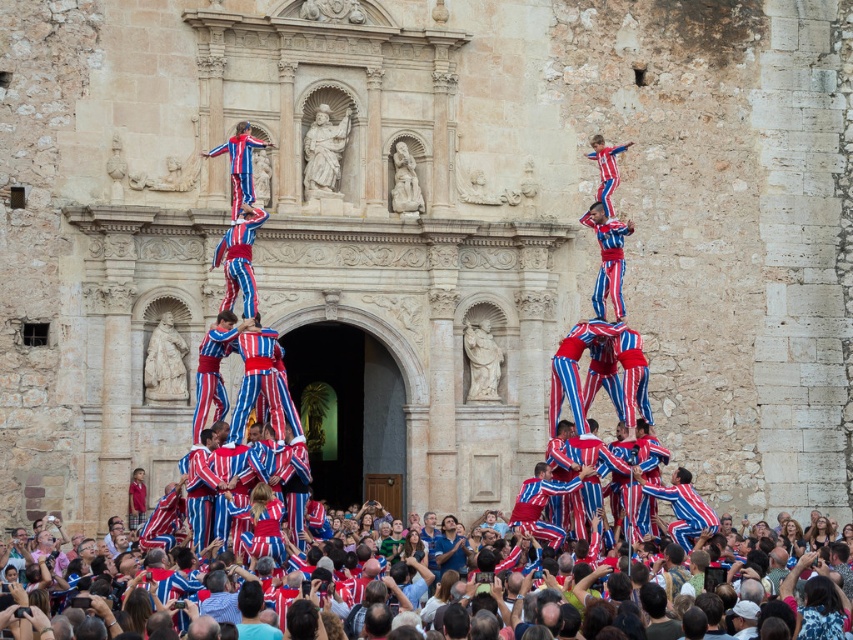
Question: Which object is closer to the camera taking this photo?

Choices:
 (A) matte red and blue striped pants at center
 (B) matte striped pants at center

Answer: (B)

Question: In this image, where is matte red fabric at lower center located relative to white marble statue at center?

Choices:
 (A) right
 (B) left

Answer: (A)

Question: Does matte red and blue striped pants at center appear on the right side of matte striped pants at center?

Choices:
 (A) yes
 (B) no

Answer: (A)

Question: Can you confirm if matte red and blue striped pants at center is wider than matte striped pants at center?

Choices:
 (A) no
 (B) yes

Answer: (B)

Question: Which of the following is the closest to the observer?

Choices:
 (A) white marble statue at center
 (B) matte red and blue striped pants at center

Answer: (B)

Question: Which object is positioned closest to the matte red and blue striped pants at center?

Choices:
 (A) matte striped pants at center
 (B) white marble statue at center

Answer: (A)